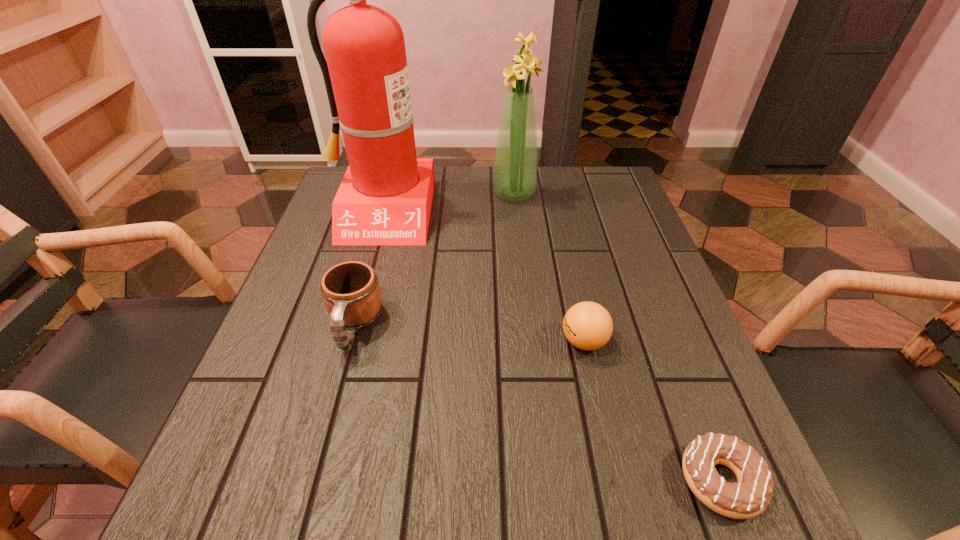
What are the coordinates of `mug at the left edge` in the screenshot? It's located at (351, 293).

The width and height of the screenshot is (960, 540). I want to click on ping-pong ball positioned at the right edge, so click(x=587, y=325).

You are a GUI agent. You are given a task and a screenshot of the screen. Output one action in this format:
    pyautogui.click(x=<x>, y=<y>)
    Task: Click on the doughnut that is at the right edge
    
    Given the screenshot: What is the action you would take?
    pyautogui.click(x=750, y=496)

Find the location of a particular element. object located in the far left corner section of the desktop is located at coordinates (385, 198).

This screenshot has height=540, width=960. Find the location of `object that is at the near right corner`. object that is at the near right corner is located at coordinates (750, 496).

The image size is (960, 540). In order to click on vacant area at the far edge of the desktop in this screenshot , I will do `click(458, 174)`.

Find the location of `free space at the near edge of the desktop`. free space at the near edge of the desktop is located at coordinates (515, 511).

The height and width of the screenshot is (540, 960). In order to click on vacant space at the left edge in this screenshot , I will do `click(338, 377)`.

In the image, there is a desktop. Identify the location of free space at the right edge. The image size is (960, 540). (609, 242).

I want to click on vacant space at the far right corner, so click(x=599, y=210).